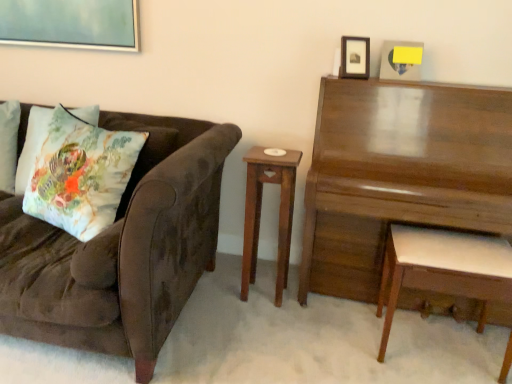
At what (x,y) coordinates should I click in order to perform the action: click on free location to the left of white wood stool at right. Please return your answer as a coordinate pair (x, y). Looking at the image, I should click on (344, 339).